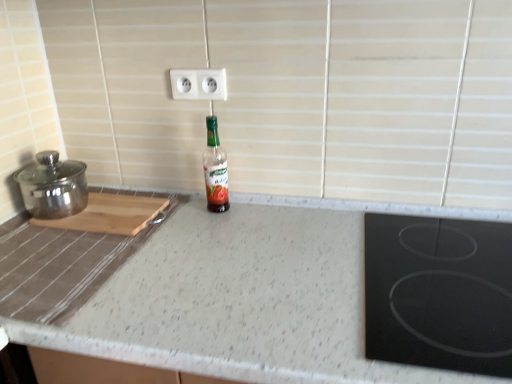
The width and height of the screenshot is (512, 384). I want to click on polished stainless steel pot at left, so click(x=53, y=186).

What do you see at coordinates (53, 186) in the screenshot?
I see `polished stainless steel pot at left` at bounding box center [53, 186].

What do you see at coordinates (110, 214) in the screenshot? I see `wooden cutting board at left` at bounding box center [110, 214].

What is the approximate height of green glass bottle at center?

green glass bottle at center is 10.18 inches in height.

The width and height of the screenshot is (512, 384). Describe the element at coordinates (214, 170) in the screenshot. I see `green glass bottle at center` at that location.

The height and width of the screenshot is (384, 512). What are the coordinates of `black glass cooktop at right` in the screenshot? It's located at (439, 293).

What is the approximate height of black glass cooktop at right?

It is 5.22 inches.

You are a GUI agent. You are given a task and a screenshot of the screen. Output one action in this format:
    pyautogui.click(x=<x>, y=<y>)
    Task: Click on the polished stainless steel pot at left
    
    Given the screenshot: What is the action you would take?
    pyautogui.click(x=53, y=186)

Looking at this image, looking at the image, does speckled granite countertop at center seem bigger or smaller compared to green glass bottle at center?

speckled granite countertop at center is bigger than green glass bottle at center.

Considering the relative positions of speckled granite countertop at center and green glass bottle at center in the image provided, is speckled granite countertop at center to the left of green glass bottle at center from the viewer's perspective?

Incorrect, speckled granite countertop at center is not on the left side of green glass bottle at center.

Which is nearer, (196,229) or (207,149)?

Point (196,229) is closer to the camera than point (207,149).

Is speckled granite countertop at center facing away from wooden cutting board at left?

That's not correct — speckled granite countertop at center is not looking away from wooden cutting board at left.

How distant is speckled granite countertop at center from wooden cutting board at left?

They are 24.58 centimeters apart.

Does speckled granite countertop at center have a lesser width compared to wooden cutting board at left?

No, speckled granite countertop at center is not thinner than wooden cutting board at left.

Considering the relative positions of speckled granite countertop at center and wooden cutting board at left in the image provided, is speckled granite countertop at center in front of wooden cutting board at left?

Yes, it is.

How different are the orientations of wooden cutting board at left and green glass bottle at center in degrees?

The angle between the facing direction of wooden cutting board at left and the facing direction of green glass bottle at center is 1.41 degrees.

Considering the sizes of objects wooden cutting board at left and green glass bottle at center in the image provided, who is thinner, wooden cutting board at left or green glass bottle at center?

green glass bottle at center is thinner.

Are wooden cutting board at left and green glass bottle at center making contact?

No, wooden cutting board at left is not next to green glass bottle at center.

Does wooden cutting board at left lie in front of green glass bottle at center?

Yes, wooden cutting board at left is closer to the viewer.

Measure the distance between white plastic electric outlet at upper center and polished stainless steel pot at left.

A distance of 41.58 centimeters exists between white plastic electric outlet at upper center and polished stainless steel pot at left.

Does white plastic electric outlet at upper center contain polished stainless steel pot at left?

No.

Does white plastic electric outlet at upper center touch polished stainless steel pot at left?

No.

Is black glass cooktop at right wider or thinner than white plastic electric outlet at upper center?

black glass cooktop at right is wider than white plastic electric outlet at upper center.

Which is less distant, (x=409, y=331) or (x=216, y=78)?

The point (x=409, y=331) is in front.

From the image's perspective, is black glass cooktop at right located beneath white plastic electric outlet at upper center?

Yes, from the image's perspective, black glass cooktop at right is below white plastic electric outlet at upper center.

From a real-world perspective, does black glass cooktop at right sit lower than white plastic electric outlet at upper center?

Indeed, from a real-world perspective, black glass cooktop at right is positioned beneath white plastic electric outlet at upper center.

Looking at the image, does black glass cooktop at right seem bigger or smaller compared to polished stainless steel pot at left?

Considering their sizes, black glass cooktop at right takes up more space than polished stainless steel pot at left.

Based on the photo, is the position of black glass cooktop at right more distant than that of polished stainless steel pot at left?

No, it is in front of polished stainless steel pot at left.

This screenshot has height=384, width=512. I want to click on home appliance on the right of polished stainless steel pot at left, so click(439, 293).

Measure the distance between black glass cooktop at right and polished stainless steel pot at left.

black glass cooktop at right is 34.35 inches away from polished stainless steel pot at left.

Is speckled granite countertop at center positioned with its back to polished stainless steel pot at left?

No, polished stainless steel pot at left is not at the back of speckled granite countertop at center.

Is polished stainless steel pot at left surrounded by speckled granite countertop at center?

No, polished stainless steel pot at left is located outside of speckled granite countertop at center.

Which of these two, speckled granite countertop at center or polished stainless steel pot at left, stands taller?

Standing taller between the two is speckled granite countertop at center.

Find the location of a particular element. countertop lying below the polished stainless steel pot at left (from the image's perspective) is located at coordinates (204, 294).

Find the location of a particular element. The image size is (512, 384). bottle above the speckled granite countertop at center (from the image's perspective) is located at coordinates (214, 170).

The image size is (512, 384). Find the location of `countertop to the right of wooden cutting board at left`. countertop to the right of wooden cutting board at left is located at coordinates click(x=204, y=294).

When comparing their distances from black glass cooktop at right, does speckled granite countertop at center or green glass bottle at center seem further?

green glass bottle at center is positioned further to the anchor black glass cooktop at right.

When comparing their distances from wooden cutting board at left, does polished stainless steel pot at left or white plastic electric outlet at upper center seem closer?

polished stainless steel pot at left.

When comparing their distances from polished stainless steel pot at left, does speckled granite countertop at center or white plastic electric outlet at upper center seem further?

Among the two, white plastic electric outlet at upper center is located further to polished stainless steel pot at left.

Based on their spatial positions, is black glass cooktop at right or green glass bottle at center further from polished stainless steel pot at left?

Based on the image, black glass cooktop at right appears to be further to polished stainless steel pot at left.

From the image, which object appears to be nearer to wooden cutting board at left, black glass cooktop at right or speckled granite countertop at center?

The object closer to wooden cutting board at left is speckled granite countertop at center.

From the picture: From the image, which object appears to be nearer to black glass cooktop at right, speckled granite countertop at center or wooden cutting board at left?

The object closer to black glass cooktop at right is speckled granite countertop at center.

Based on their spatial positions, is wooden cutting board at left or speckled granite countertop at center further from white plastic electric outlet at upper center?

speckled granite countertop at center is further to white plastic electric outlet at upper center.

Based on their spatial positions, is white plastic electric outlet at upper center or green glass bottle at center further from polished stainless steel pot at left?

white plastic electric outlet at upper center is further to polished stainless steel pot at left.

This screenshot has width=512, height=384. Find the location of `cutting board between speckled granite countertop at center and green glass bottle at center from front to back`. cutting board between speckled granite countertop at center and green glass bottle at center from front to back is located at coordinates (110, 214).

Locate an element on the screen. The width and height of the screenshot is (512, 384). countertop situated between polished stainless steel pot at left and black glass cooktop at right from left to right is located at coordinates (204, 294).

Identify the location of cutting board between white plastic electric outlet at upper center and speckled granite countertop at center in the vertical direction. (110, 214).

Identify the location of kitchen appliance that lies between white plastic electric outlet at upper center and speckled granite countertop at center from top to bottom. This screenshot has width=512, height=384. (53, 186).